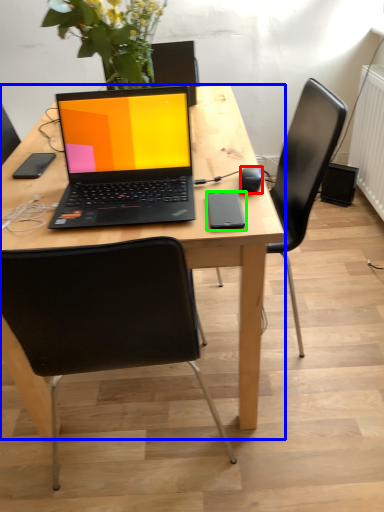
Question: Which object is positioned closest to computer mouse (highlighted by a red box)? Select from desk (highlighted by a blue box) and mobile phone (highlighted by a green box).

Choices:
 (A) desk
 (B) mobile phone

Answer: (B)